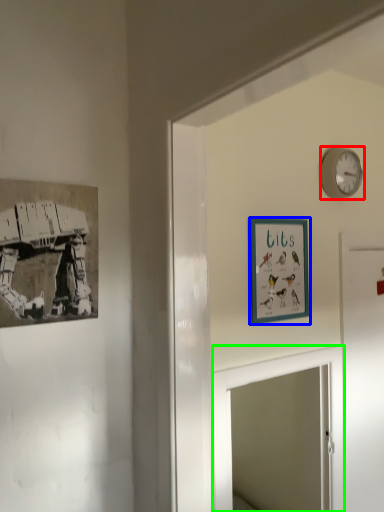
Question: Which object is the closest to the wall clock (highlighted by a red box)? Choose among these: picture frame (highlighted by a blue box) or mirror (highlighted by a green box).

Choices:
 (A) picture frame
 (B) mirror

Answer: (A)